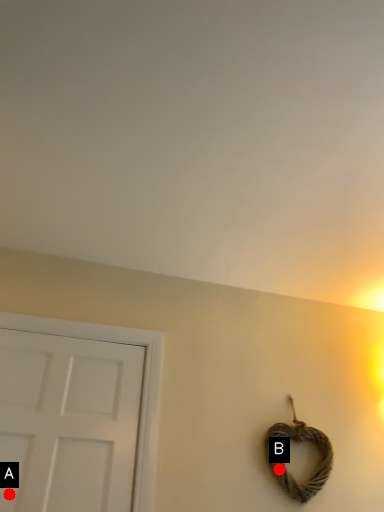
Question: Two points are circled on the image, labeled by A and B beside each circle. Which point is closer to the camera?

Choices:
 (A) A is closer
 (B) B is closer

Answer: (A)